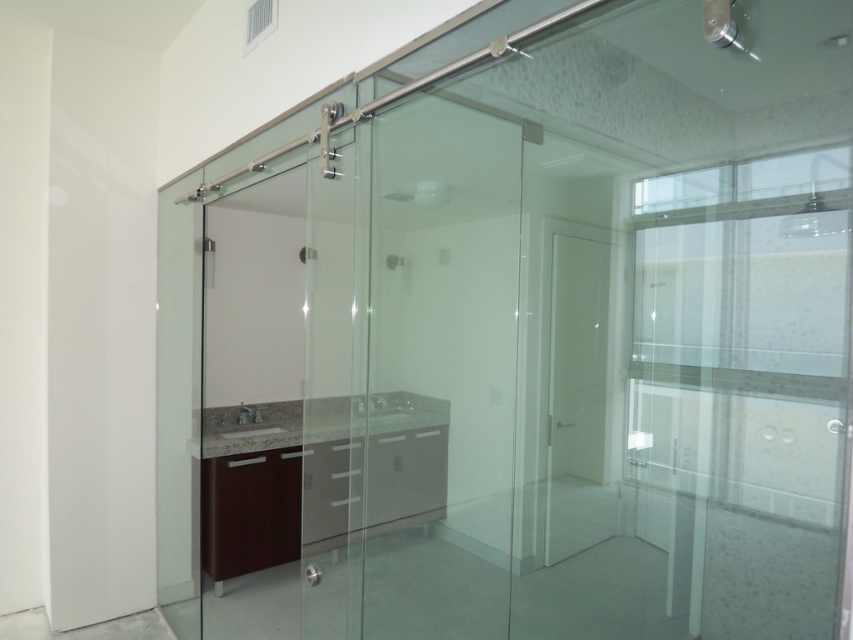
Question: Does white matte door at center appear on the right side of gray granite sink at center?

Choices:
 (A) no
 (B) yes

Answer: (B)

Question: Is gray granite sink at center bigger than clear glass shower at center?

Choices:
 (A) no
 (B) yes

Answer: (B)

Question: Which object is farther from the camera taking this photo?

Choices:
 (A) clear glass shower at center
 (B) gray granite sink at center

Answer: (B)

Question: Estimate the real-world distances between objects in this image. Which object is farther from the gray granite sink at center?

Choices:
 (A) white matte door at center
 (B) clear glass shower at center

Answer: (B)

Question: Which of the following is the closest to the observer?

Choices:
 (A) (323, 157)
 (B) (248, 422)
 (C) (598, 406)

Answer: (A)

Question: Is white matte door at center closer to the viewer compared to gray granite sink at center?

Choices:
 (A) no
 (B) yes

Answer: (A)